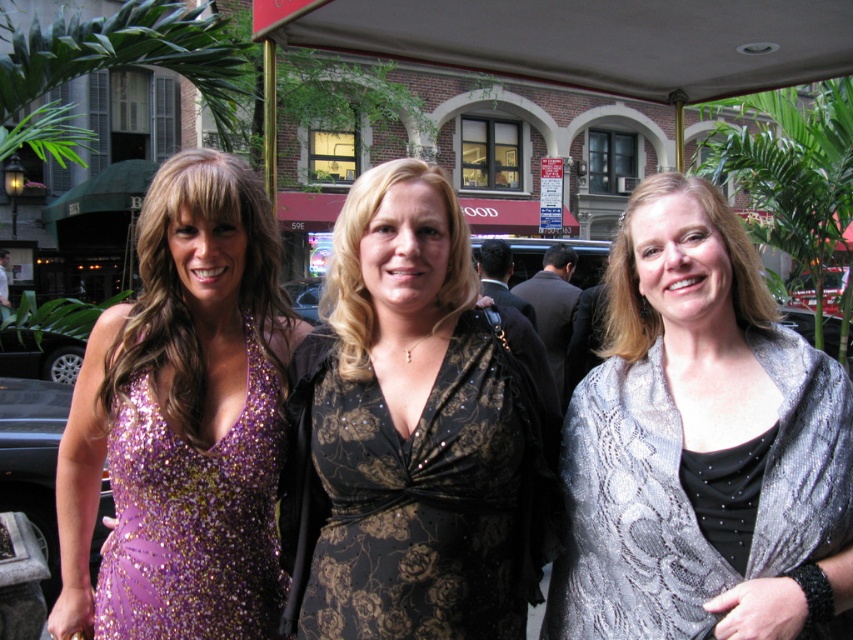
Which of these two, white fabric canopy at upper center or lavender sequined dress at left, stands taller?

lavender sequined dress at left

Can you confirm if white fabric canopy at upper center is shorter than lavender sequined dress at left?

Correct, white fabric canopy at upper center is not as tall as lavender sequined dress at left.

Measure the distance between point (339, 33) and camera.

Point (339, 33) and camera are 19.12 feet apart.

Locate an element on the screen. The height and width of the screenshot is (640, 853). white fabric canopy at upper center is located at coordinates (587, 38).

Which is in front, point (341, 516) or point (131, 413)?

Point (341, 516) is more forward.

Where is `black sequined dress at center`? The width and height of the screenshot is (853, 640). black sequined dress at center is located at coordinates (419, 492).

The height and width of the screenshot is (640, 853). In order to click on black sequined dress at center in this screenshot , I will do `click(419, 492)`.

Which is below, silver sequined shawl at center or lavender sequined dress at left?

lavender sequined dress at left is lower down.

Which is more to the right, silver sequined shawl at center or lavender sequined dress at left?

From the viewer's perspective, silver sequined shawl at center appears more on the right side.

Locate an element on the screen. silver sequined shawl at center is located at coordinates (701, 445).

You are a GUI agent. You are given a task and a screenshot of the screen. Output one action in this format:
    pyautogui.click(x=<x>, y=<y>)
    Task: Click on the silver sequined shawl at center
    This screenshot has height=640, width=853.
    Given the screenshot: What is the action you would take?
    pyautogui.click(x=701, y=445)